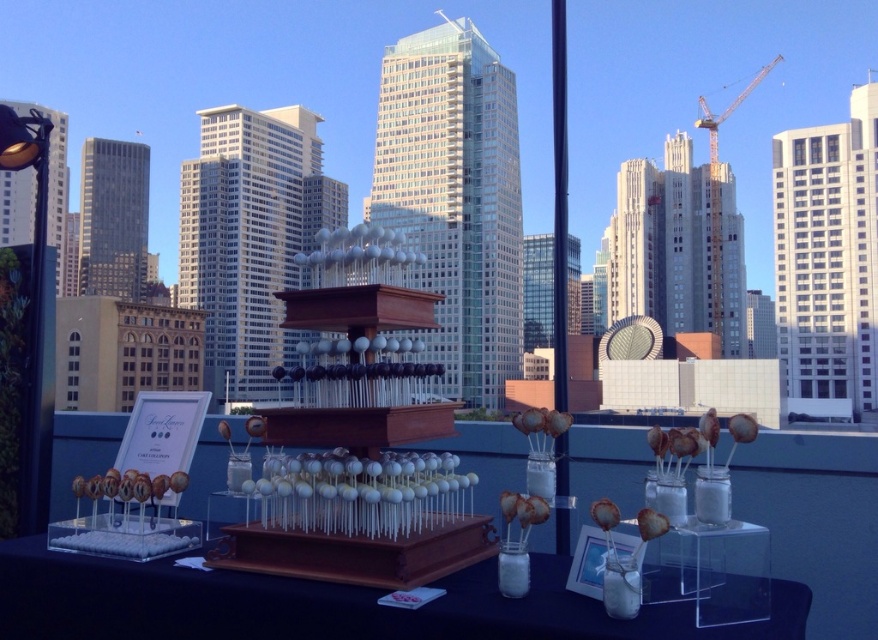
You are a customer at a rooftop dessert stand and want to take a photo of the clear acrylic table at center and the white glossy cake pops at center. Since you want the city skyline in the background, which object should you focus on to ensure the skyline is visible through it?

The clear acrylic table at center is transparent, so focusing on it will allow the city skyline to be seen through it while capturing both the clear acrylic table at center and the white glossy cake pops at center in the photo.

You are a food delivery person who needs to place a matte chocolate donut at lower left on the clear acrylic table at center. Can you fit it on the table?

The clear acrylic table at center is smaller than the matte chocolate donut at lower left, so the donut will not fit on the table.